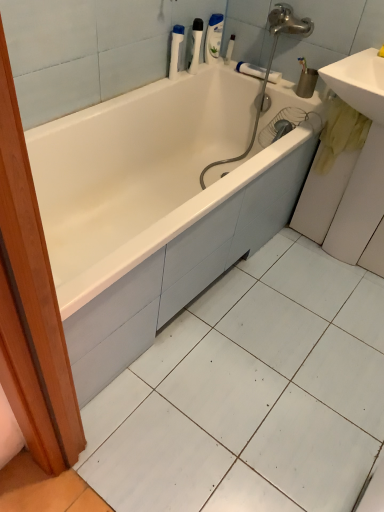
Describe the element at coordinates (195, 45) in the screenshot. This screenshot has width=384, height=512. I see `translucent plastic toothbrush at upper center, the 2th toiletry viewed from the back` at that location.

Describe the element at coordinates (229, 49) in the screenshot. I see `white plastic bottle at upper center, marked as the first toiletry in a right-to-left arrangement` at that location.

At what (x,y) coordinates should I click in order to perform the action: click on white glossy sink at upper right, which is counted as the first sink, starting from the top. Please return your answer as a coordinate pair (x, y). The height and width of the screenshot is (512, 384). Looking at the image, I should click on (359, 82).

What is the approximate width of white plastic bottle at upper center, the second cleaning product from the back?

2.50 inches.

What do you see at coordinates (213, 38) in the screenshot? I see `translucent plastic bottle at upper center, marked as the 2th cleaning product in a left-to-right arrangement` at bounding box center [213, 38].

Image resolution: width=384 pixels, height=512 pixels. I want to click on translucent plastic toothbrush at upper center, positioned as the 1th toiletry in front-to-back order, so click(x=195, y=45).

Is white plastic bottle at upper center, marked as the first toiletry in a right-to-left arrangement, next to translucent plastic bottle at upper center, which ranks as the first cleaning product in back-to-front order, and touching it?

No, white plastic bottle at upper center, marked as the first toiletry in a right-to-left arrangement, is not next to translucent plastic bottle at upper center, which ranks as the first cleaning product in back-to-front order.

Does white plastic bottle at upper center, placed as the first toiletry when sorted from back to front, come behind translucent plastic bottle at upper center, acting as the second cleaning product starting from the front?

Yes, white plastic bottle at upper center, placed as the first toiletry when sorted from back to front, is behind translucent plastic bottle at upper center, acting as the second cleaning product starting from the front.

Looking at this image, how different are the orientations of white plastic bottle at upper center, the second toiletry in the front-to-back sequence, and translucent plastic bottle at upper center, placed as the first cleaning product when sorted from right to left, in degrees?

They differ by 90 degrees in their facing directions.

Is white plastic bottle at upper center, acting as the 2th toiletry starting from the left, to the right of translucent plastic bottle at upper center, which ranks as the first cleaning product in back-to-front order, from the viewer's perspective?

Correct, you'll find white plastic bottle at upper center, acting as the 2th toiletry starting from the left, to the right of translucent plastic bottle at upper center, which ranks as the first cleaning product in back-to-front order.

Considering the sizes of objects white glossy sink at upper right, which is counted as the first sink, starting from the top, and white glossy bathtub at center in the image provided, who is shorter, white glossy sink at upper right, which is counted as the first sink, starting from the top, or white glossy bathtub at center?

white glossy sink at upper right, which is counted as the first sink, starting from the top, is shorter.

From the image's perspective, is white glossy sink at upper right, the second sink from the bottom, beneath white glossy bathtub at center?

Actually, white glossy sink at upper right, the second sink from the bottom, appears above white glossy bathtub at center in the image.

Which point is more forward, (370,112) or (141,89)?

The point (370,112) is in front.

From the image's perspective, is white plastic towel bar at upper center over white glossy bathtub at center?

Indeed, from the image's perspective, white plastic towel bar at upper center is shown above white glossy bathtub at center.

Is white plastic towel bar at upper center in front of or behind white glossy bathtub at center in the image?

Clearly, white plastic towel bar at upper center is behind white glossy bathtub at center.

Considering the relative sizes of white plastic towel bar at upper center and white glossy bathtub at center in the image provided, is white plastic towel bar at upper center taller than white glossy bathtub at center?

No, white plastic towel bar at upper center is not taller than white glossy bathtub at center.

Is white plastic bottle at upper center, the second cleaning product from the back, far from white glossy sink at right, which is counted as the second sink, starting from the top?

white plastic bottle at upper center, the second cleaning product from the back, is near white glossy sink at right, which is counted as the second sink, starting from the top, not far away.

In the scene shown: Considering the sizes of white plastic bottle at upper center, which is the 1th cleaning product in left-to-right order, and white glossy sink at right, which is counted as the second sink, starting from the top, in the image, is white plastic bottle at upper center, which is the 1th cleaning product in left-to-right order, wider or thinner than white glossy sink at right, which is counted as the second sink, starting from the top,?

Considering their sizes, white plastic bottle at upper center, which is the 1th cleaning product in left-to-right order, looks slimmer than white glossy sink at right, which is counted as the second sink, starting from the top.

Does point (173, 58) come in front of point (343, 246)?

Yes, point (173, 58) is in front of point (343, 246).

Does white plastic bottle at upper center, the first cleaning product from the front, have a lesser height compared to white glossy sink at right, which is counted as the second sink, starting from the top?

Indeed, white plastic bottle at upper center, the first cleaning product from the front, has a lesser height compared to white glossy sink at right, which is counted as the second sink, starting from the top.

How different are the orientations of white glossy sink at upper right, which is counted as the first sink, starting from the top, and white plastic bottle at upper center, acting as the 2th cleaning product starting from the right, in degrees?

white glossy sink at upper right, which is counted as the first sink, starting from the top, and white plastic bottle at upper center, acting as the 2th cleaning product starting from the right, are facing 88.8 degrees away from each other.

Based on the photo, can you confirm if white glossy sink at upper right, which is counted as the first sink, starting from the top, is taller than white plastic bottle at upper center, the first cleaning product from the front?

In fact, white glossy sink at upper right, which is counted as the first sink, starting from the top, may be shorter than white plastic bottle at upper center, the first cleaning product from the front.

Which of these two, white glossy sink at upper right, the second sink from the bottom, or white plastic bottle at upper center, which is the 1th cleaning product in left-to-right order, is wider?

white glossy sink at upper right, the second sink from the bottom.

Measure the distance from translucent plastic toothbrush at upper center, positioned as the 1th toiletry in front-to-back order, to white glossy sink at upper right, the second sink from the bottom.

30.25 inches.

From the picture: From the image's perspective, is translucent plastic toothbrush at upper center, which ranks as the 1th toiletry in left-to-right order, beneath white glossy sink at upper right, the second sink from the bottom?

No.

Considering the relative sizes of translucent plastic toothbrush at upper center, which ranks as the 1th toiletry in left-to-right order, and white glossy sink at upper right, the second sink from the bottom, in the image provided, is translucent plastic toothbrush at upper center, which ranks as the 1th toiletry in left-to-right order, wider than white glossy sink at upper right, the second sink from the bottom,?

No, translucent plastic toothbrush at upper center, which ranks as the 1th toiletry in left-to-right order, is not wider than white glossy sink at upper right, the second sink from the bottom.

Which of these two, white plastic bottle at upper center, the second toiletry in the front-to-back sequence, or translucent plastic toothbrush at upper center, the 2th toiletry viewed from the back, stands taller?

With more height is translucent plastic toothbrush at upper center, the 2th toiletry viewed from the back.

Could translucent plastic toothbrush at upper center, the 2th toiletry when ordered from right to left, be considered to be inside white plastic bottle at upper center, placed as the first toiletry when sorted from back to front?

Actually, translucent plastic toothbrush at upper center, the 2th toiletry when ordered from right to left, is outside white plastic bottle at upper center, placed as the first toiletry when sorted from back to front.

This screenshot has height=512, width=384. What are the coordinates of `toiletry above the white plastic bottle at upper center, the second toiletry in the front-to-back sequence (from a real-world perspective)` in the screenshot? It's located at (195, 45).

Which is in front, white plastic bottle at upper center, acting as the 2th toiletry starting from the left, or translucent plastic toothbrush at upper center, the 2th toiletry viewed from the back?

Positioned in front is translucent plastic toothbrush at upper center, the 2th toiletry viewed from the back.

This screenshot has width=384, height=512. I want to click on the 1st cleaning product counting from the left of the white plastic bottle at upper center, acting as the 2th toiletry starting from the left, so click(213, 38).

From the image's perspective, count 2nd sinks upward from the white glossy bathtub at center and point to it. Please provide its 2D coordinates.

[(359, 82)]

Estimate the real-world distances between objects in this image. Which object is further from translucent plastic toothbrush at upper center, the 2th toiletry when ordered from right to left, translucent plastic bottle at upper center, which ranks as the first cleaning product in back-to-front order, or white plastic towel bar at upper center?

white plastic towel bar at upper center is further to translucent plastic toothbrush at upper center, the 2th toiletry when ordered from right to left.

From the image, which object appears to be farther from white plastic bottle at upper center, the second cleaning product from the back, white glossy sink at upper right, which is counted as the first sink, starting from the top, or translucent plastic toothbrush at upper center, positioned as the 1th toiletry in front-to-back order?

white glossy sink at upper right, which is counted as the first sink, starting from the top, is further to white plastic bottle at upper center, the second cleaning product from the back.

Based on their spatial positions, is translucent plastic toothbrush at upper center, positioned as the 1th toiletry in front-to-back order, or white glossy sink at upper right, which is counted as the first sink, starting from the top, closer to white glossy sink at right, which ranks as the 1th sink in bottom-to-top order?

white glossy sink at upper right, which is counted as the first sink, starting from the top, lies closer to white glossy sink at right, which ranks as the 1th sink in bottom-to-top order, than the other object.

Looking at the image, which one is located further to translucent plastic toothbrush at upper center, the 2th toiletry viewed from the back, white plastic bottle at upper center, acting as the 2th cleaning product starting from the right, or white glossy sink at upper right, the second sink from the bottom?

white glossy sink at upper right, the second sink from the bottom, is further to translucent plastic toothbrush at upper center, the 2th toiletry viewed from the back.

Considering their positions, is white glossy sink at upper right, the second sink from the bottom, positioned further to white glossy bathtub at center than translucent plastic toothbrush at upper center, positioned as the 1th toiletry in front-to-back order?

translucent plastic toothbrush at upper center, positioned as the 1th toiletry in front-to-back order, is positioned further to the anchor white glossy bathtub at center.

When comparing their distances from white plastic bottle at upper center, acting as the 2th toiletry starting from the left, does white plastic towel bar at upper center or white glossy bathtub at center seem closer?

white plastic towel bar at upper center.

From the picture: Estimate the real-world distances between objects in this image. Which object is further from translucent plastic toothbrush at upper center, which ranks as the 1th toiletry in left-to-right order, white glossy sink at right, which is counted as the second sink, starting from the top, or white plastic towel bar at upper center?

The object further to translucent plastic toothbrush at upper center, which ranks as the 1th toiletry in left-to-right order, is white glossy sink at right, which is counted as the second sink, starting from the top.

Which object lies further to the anchor point white glossy sink at upper right, which is counted as the first sink, starting from the top, white plastic bottle at upper center, placed as the first toiletry when sorted from back to front, or translucent plastic bottle at upper center, marked as the 2th cleaning product in a left-to-right arrangement?

white plastic bottle at upper center, placed as the first toiletry when sorted from back to front.

What are the coordinates of `cleaning product located between white plastic bottle at upper center, the second cleaning product from the back, and white plastic towel bar at upper center in the left-right direction` in the screenshot? It's located at (213, 38).

This screenshot has width=384, height=512. What are the coordinates of `towel bar between white plastic bottle at upper center, the second toiletry in the front-to-back sequence, and white glossy sink at right, which is counted as the second sink, starting from the top, in the vertical direction` in the screenshot? It's located at (251, 70).

Where is `cleaning product between white plastic bottle at upper center, the first cleaning product from the front, and white glossy sink at upper right, the second sink from the bottom, in the horizontal direction`? This screenshot has width=384, height=512. cleaning product between white plastic bottle at upper center, the first cleaning product from the front, and white glossy sink at upper right, the second sink from the bottom, in the horizontal direction is located at coordinates (213, 38).

Locate an element on the screen. This screenshot has height=512, width=384. toiletry between white glossy sink at upper right, the second sink from the bottom, and white plastic bottle at upper center, the second toiletry in the front-to-back sequence, from front to back is located at coordinates (195, 45).